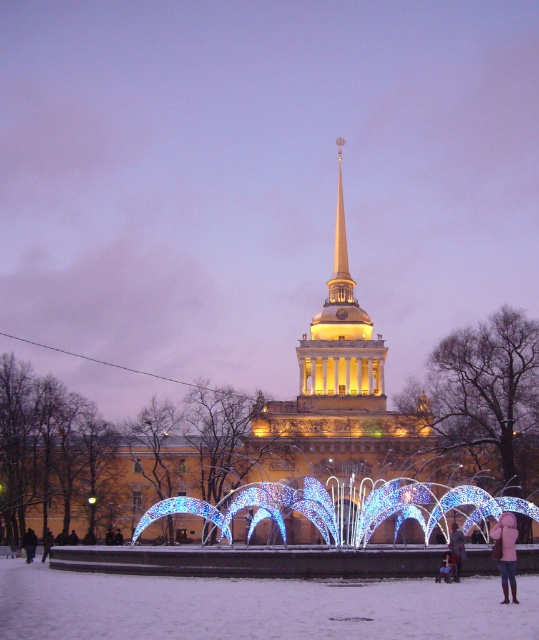
Question: Among these points, which one is farthest from the camera?

Choices:
 (A) (342, 209)
 (B) (497, 518)

Answer: (A)

Question: Which of the following is the closest to the observer?

Choices:
 (A) (336, 243)
 (B) (505, 520)

Answer: (B)

Question: Is gold polished spire at center wider than light pink woolen coat at lower right?

Choices:
 (A) yes
 (B) no

Answer: (A)

Question: From the image, what is the correct spatial relationship of gold polished spire at center in relation to light pink woolen coat at lower right?

Choices:
 (A) left
 (B) right

Answer: (A)

Question: Is gold polished spire at center further to camera compared to light pink woolen coat at lower right?

Choices:
 (A) no
 (B) yes

Answer: (B)